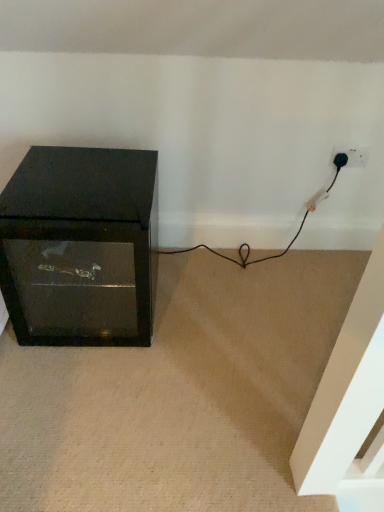
Question: Can you confirm if black plastic plug at lower right is positioned to the right of matte black cabinet at left?

Choices:
 (A) no
 (B) yes

Answer: (B)

Question: Does black plastic plug at lower right have a lesser height compared to matte black cabinet at left?

Choices:
 (A) yes
 (B) no

Answer: (A)

Question: Can you confirm if black plastic plug at lower right is thinner than matte black cabinet at left?

Choices:
 (A) no
 (B) yes

Answer: (B)

Question: Are black plastic plug at lower right and matte black cabinet at left beside each other?

Choices:
 (A) yes
 (B) no

Answer: (B)

Question: Can you confirm if black plastic plug at lower right is bigger than matte black cabinet at left?

Choices:
 (A) no
 (B) yes

Answer: (A)

Question: From a real-world perspective, is black plastic plug at lower right positioned under matte black cabinet at left based on gravity?

Choices:
 (A) yes
 (B) no

Answer: (B)

Question: Is matte black cabinet at left aimed at black plastic plug at lower right?

Choices:
 (A) no
 (B) yes

Answer: (A)

Question: From the image's perspective, does matte black cabinet at left appear higher than black plastic plug at lower right?

Choices:
 (A) no
 (B) yes

Answer: (A)

Question: Is black plastic plug at lower right a part of matte black cabinet at left?

Choices:
 (A) no
 (B) yes

Answer: (A)

Question: Is matte black cabinet at left to the right of black plastic plug at lower right from the viewer's perspective?

Choices:
 (A) yes
 (B) no

Answer: (B)

Question: Can we say matte black cabinet at left lies outside black plastic plug at lower right?

Choices:
 (A) yes
 (B) no

Answer: (A)

Question: Considering the relative sizes of matte black cabinet at left and black plastic plug at lower right in the image provided, is matte black cabinet at left wider than black plastic plug at lower right?

Choices:
 (A) no
 (B) yes

Answer: (B)

Question: From their relative heights in the image, would you say matte black cabinet at left is taller or shorter than black plastic plug at lower right?

Choices:
 (A) short
 (B) tall

Answer: (B)